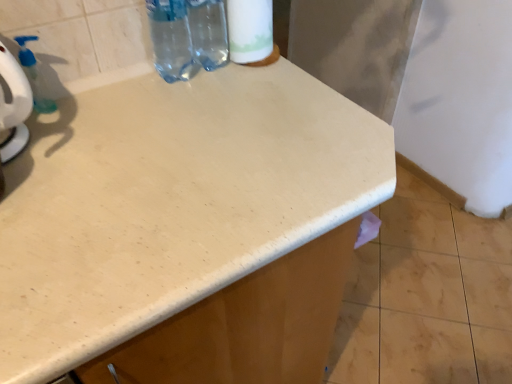
Image resolution: width=512 pixels, height=384 pixels. Describe the element at coordinates (208, 32) in the screenshot. I see `transparent plastic bottle at upper center, arranged as the second bottle when viewed from the left` at that location.

In order to click on transparent plastic bottle at upper center, the first bottle viewed from the left in this screenshot , I will do `click(170, 39)`.

Where is `beige speckled countertop at center`? beige speckled countertop at center is located at coordinates (187, 229).

Measure the distance between point (302, 200) and camera.

They are 26.73 inches apart.

What are the coordinates of `transparent plastic soap dispenser at upper left` in the screenshot? It's located at (33, 75).

Is transparent plastic soap dispenser at upper left positioned with its back to transparent plastic bottle at upper center, which is counted as the 1th bottle, starting from the right?

No, transparent plastic soap dispenser at upper left is not facing away from transparent plastic bottle at upper center, which is counted as the 1th bottle, starting from the right.

From the image's perspective, is transparent plastic soap dispenser at upper left located beneath transparent plastic bottle at upper center, which is counted as the 1th bottle, starting from the right?

Indeed, from the image's perspective, transparent plastic soap dispenser at upper left is shown beneath transparent plastic bottle at upper center, which is counted as the 1th bottle, starting from the right.

Are transparent plastic soap dispenser at upper left and transparent plastic bottle at upper center, which is counted as the 1th bottle, starting from the right, located far from each other?

No.

Between transparent plastic soap dispenser at upper left and transparent plastic bottle at upper center, which is counted as the 1th bottle, starting from the right, which one appears on the left side from the viewer's perspective?

Positioned to the left is transparent plastic soap dispenser at upper left.

Consider the image. Who is smaller, transparent plastic soap dispenser at upper left or beige speckled countertop at center?

Smaller between the two is transparent plastic soap dispenser at upper left.

From a real-world perspective, is transparent plastic soap dispenser at upper left above or below beige speckled countertop at center?

In terms of real-world spatial position, transparent plastic soap dispenser at upper left is above beige speckled countertop at center.

Which object is thinner, transparent plastic soap dispenser at upper left or beige speckled countertop at center?

Thinner between the two is transparent plastic soap dispenser at upper left.

Is transparent plastic bottle at upper center, arranged as the second bottle when viewed from the left, not close to transparent plastic soap dispenser at upper left?

That's not correct — transparent plastic bottle at upper center, arranged as the second bottle when viewed from the left, is a little close to transparent plastic soap dispenser at upper left.

Measure the distance between transparent plastic bottle at upper center, arranged as the second bottle when viewed from the left, and transparent plastic soap dispenser at upper left.

transparent plastic bottle at upper center, arranged as the second bottle when viewed from the left, and transparent plastic soap dispenser at upper left are 14.56 inches apart.

Locate an element on the screen. The image size is (512, 384). soap dispenser on the left of the transparent plastic bottle at upper center, which is counted as the 1th bottle, starting from the right is located at coordinates (33, 75).

Based on the photo, can you tell me how much transparent plastic bottle at upper center, which is counted as the 1th bottle, starting from the right, and transparent plastic soap dispenser at upper left differ in facing direction?

There is a 0.00873-degree angle between the facing directions of transparent plastic bottle at upper center, which is counted as the 1th bottle, starting from the right, and transparent plastic soap dispenser at upper left.

From the image's perspective, would you say beige speckled countertop at center is shown under transparent plastic soap dispenser at upper left?

Yes, from the image's perspective, beige speckled countertop at center is beneath transparent plastic soap dispenser at upper left.

Is beige speckled countertop at center oriented towards transparent plastic soap dispenser at upper left?

No.

Which object is positioned more to the right, beige speckled countertop at center or transparent plastic soap dispenser at upper left?

Positioned to the right is beige speckled countertop at center.

In terms of width, does beige speckled countertop at center look wider or thinner when compared to transparent plastic soap dispenser at upper left?

In the image, beige speckled countertop at center appears to be wider than transparent plastic soap dispenser at upper left.

Does white matte toilet paper at upper center contain transparent plastic bottle at upper center, which is counted as the 1th bottle, starting from the right?

No, white matte toilet paper at upper center does not contain transparent plastic bottle at upper center, which is counted as the 1th bottle, starting from the right.

From a real-world perspective, is white matte toilet paper at upper center positioned above or below transparent plastic bottle at upper center, arranged as the second bottle when viewed from the left?

white matte toilet paper at upper center is situated higher than transparent plastic bottle at upper center, arranged as the second bottle when viewed from the left, in the real world.

Does white matte toilet paper at upper center touch transparent plastic bottle at upper center, arranged as the second bottle when viewed from the left?

Yes, white matte toilet paper at upper center is next to transparent plastic bottle at upper center, arranged as the second bottle when viewed from the left.

From the image's perspective, is white matte toilet paper at upper center on transparent plastic bottle at upper center, arranged as the second bottle when viewed from the left?

Yes.

Can we say transparent plastic soap dispenser at upper left lies outside white matte toilet paper at upper center?

Yes.

Visually, is transparent plastic soap dispenser at upper left positioned to the left or to the right of white matte toilet paper at upper center?

Based on their positions, transparent plastic soap dispenser at upper left is located to the left of white matte toilet paper at upper center.

Between transparent plastic soap dispenser at upper left and white matte toilet paper at upper center, which one is positioned in front?

white matte toilet paper at upper center is closer to the camera.

From the image's perspective, would you say transparent plastic soap dispenser at upper left is positioned over white matte toilet paper at upper center?

No, from the image's perspective, transparent plastic soap dispenser at upper left is not on top of white matte toilet paper at upper center.

In the image, is transparent plastic bottle at upper center, arranged as the second bottle when viewed from the left, on the left side or the right side of beige speckled countertop at center?

Clearly, transparent plastic bottle at upper center, arranged as the second bottle when viewed from the left, is on the left of beige speckled countertop at center in the image.

Which bottle is the 2nd one when counting from the back of the beige speckled countertop at center? Please provide its 2D coordinates.

[(208, 32)]

Can you confirm if transparent plastic bottle at upper center, arranged as the second bottle when viewed from the left, is thinner than beige speckled countertop at center?

Yes, transparent plastic bottle at upper center, arranged as the second bottle when viewed from the left, is thinner than beige speckled countertop at center.

Is transparent plastic bottle at upper center, arranged as the second bottle when viewed from the left, surrounding beige speckled countertop at center?

That's incorrect, beige speckled countertop at center is not inside transparent plastic bottle at upper center, arranged as the second bottle when viewed from the left.

You are a GUI agent. You are given a task and a screenshot of the screen. Output one action in this format:
    pyautogui.click(x=<x>, y=<y>)
    Task: Click on the soap dispenser below the transparent plastic bottle at upper center, which is counted as the 1th bottle, starting from the right (from a real-world perspective)
    
    Given the screenshot: What is the action you would take?
    [x=33, y=75]

Identify the location of soap dispenser that is above the beige speckled countertop at center (from a real-world perspective). Image resolution: width=512 pixels, height=384 pixels. (33, 75).

Which object lies further to the anchor point beige speckled countertop at center, transparent plastic bottle at upper center, the first bottle viewed from the left, or white matte toilet paper at upper center?

white matte toilet paper at upper center.

Consider the image. Considering their positions, is transparent plastic soap dispenser at upper left positioned further to transparent plastic bottle at upper center, arranged as the second bottle when viewed from the left, than white matte toilet paper at upper center?

transparent plastic soap dispenser at upper left.

Which object lies further to the anchor point transparent plastic bottle at upper center, the first bottle viewed from the left, transparent plastic soap dispenser at upper left or transparent plastic bottle at upper center, arranged as the second bottle when viewed from the left?

The object further to transparent plastic bottle at upper center, the first bottle viewed from the left, is transparent plastic soap dispenser at upper left.

From the image, which object appears to be farther from beige speckled countertop at center, transparent plastic bottle at upper center, the first bottle viewed from the left, or transparent plastic soap dispenser at upper left?

transparent plastic soap dispenser at upper left lies further to beige speckled countertop at center than the other object.

Based on their spatial positions, is transparent plastic bottle at upper center, which is counted as the 1th bottle, starting from the right, or white matte toilet paper at upper center further from transparent plastic soap dispenser at upper left?

Based on the image, white matte toilet paper at upper center appears to be further to transparent plastic soap dispenser at upper left.

Consider the image. Considering their positions, is transparent plastic bottle at upper center, which is counted as the 1th bottle, starting from the right, positioned closer to transparent plastic bottle at upper center, which is the second bottle in right-to-left order, than transparent plastic soap dispenser at upper left?

Based on the image, transparent plastic bottle at upper center, which is counted as the 1th bottle, starting from the right, appears to be nearer to transparent plastic bottle at upper center, which is the second bottle in right-to-left order.

From the image, which object appears to be nearer to transparent plastic bottle at upper center, which is the second bottle in right-to-left order, white matte toilet paper at upper center or transparent plastic soap dispenser at upper left?

white matte toilet paper at upper center is closer to transparent plastic bottle at upper center, which is the second bottle in right-to-left order.

Looking at the image, which one is located closer to transparent plastic bottle at upper center, which is the second bottle in right-to-left order, beige speckled countertop at center or transparent plastic soap dispenser at upper left?

The object closer to transparent plastic bottle at upper center, which is the second bottle in right-to-left order, is transparent plastic soap dispenser at upper left.

Locate an element on the screen. soap dispenser between transparent plastic bottle at upper center, arranged as the second bottle when viewed from the left, and beige speckled countertop at center, in the vertical direction is located at coordinates (33, 75).

Locate an element on the screen. The width and height of the screenshot is (512, 384). bottle located between transparent plastic bottle at upper center, the first bottle viewed from the left, and white matte toilet paper at upper center in the left-right direction is located at coordinates (208, 32).

This screenshot has width=512, height=384. Find the location of `soap dispenser that lies between white matte toilet paper at upper center and beige speckled countertop at center from top to bottom`. soap dispenser that lies between white matte toilet paper at upper center and beige speckled countertop at center from top to bottom is located at coordinates (33, 75).

Where is `soap dispenser between transparent plastic bottle at upper center, the first bottle viewed from the left, and beige speckled countertop at center vertically`? soap dispenser between transparent plastic bottle at upper center, the first bottle viewed from the left, and beige speckled countertop at center vertically is located at coordinates (33, 75).